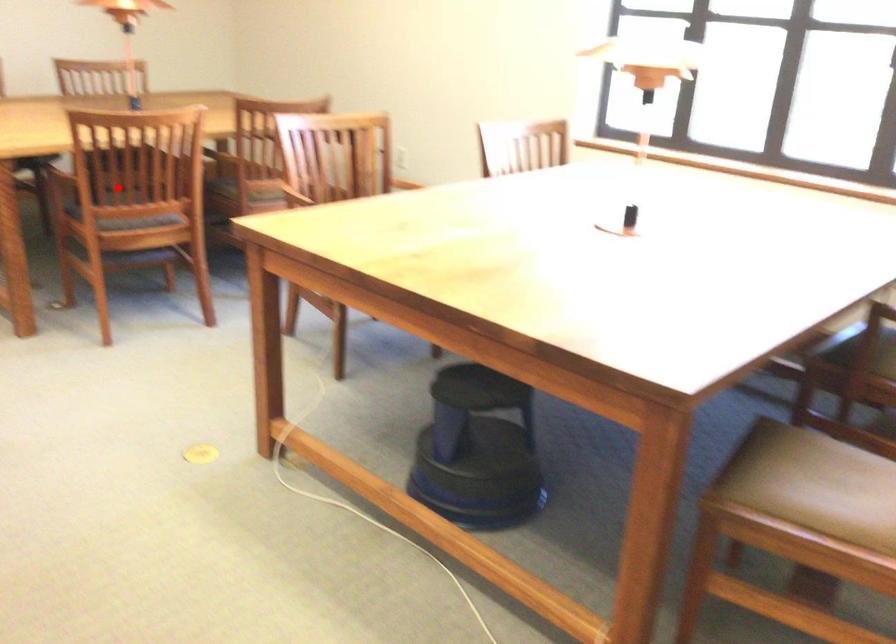
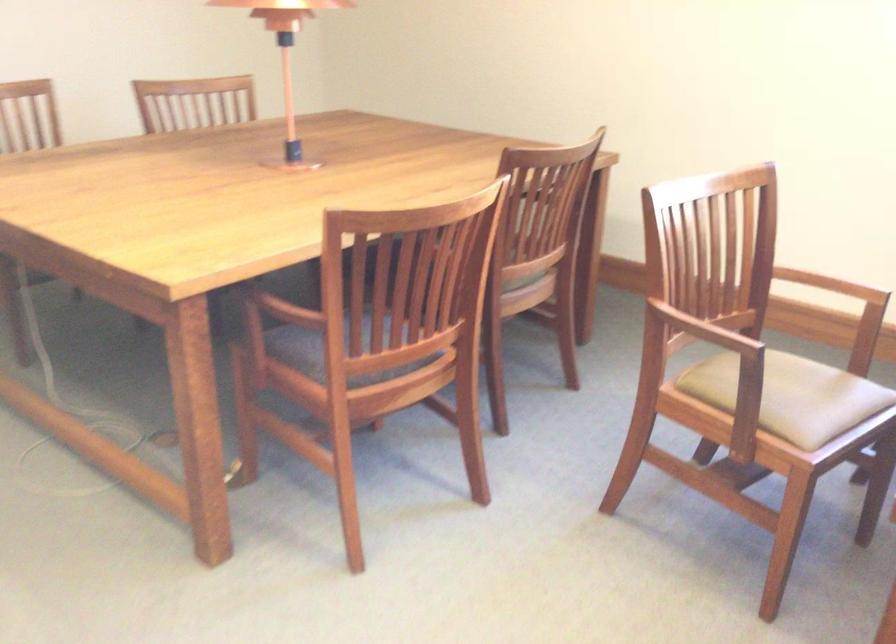
Question: I am providing you with two images of the same scene from different viewpoints. In image1, a red point is highlighted. Considering the same 3D point in image2, which of the following is correct?

Choices:
 (A) It is closer
 (B) It is farther

Answer: (A)